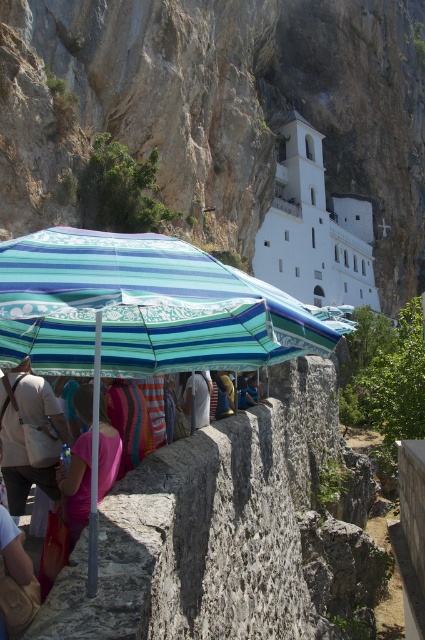
Question: Which object is positioned farthest from the pink fabric at center?

Choices:
 (A) striped fabric umbrella at center
 (B) white stone building at center

Answer: (B)

Question: Considering the relative positions of light pink fabric bag at lower left and pink fabric at center in the image provided, where is light pink fabric bag at lower left located with respect to pink fabric at center?

Choices:
 (A) right
 (B) left

Answer: (B)

Question: Among these points, which one is nearest to the camera?

Choices:
 (A) (11, 464)
 (B) (320, 248)
 (C) (104, 492)
 (D) (42, 333)

Answer: (C)

Question: Considering the real-world distances, which object is closest to the striped fabric umbrella at center?

Choices:
 (A) white cotton shirt at center
 (B) white stone building at center
 (C) pink fabric at center
 (D) light pink fabric bag at lower left

Answer: (C)

Question: Does striped fabric umbrella at center have a greater width compared to white cotton shirt at center?

Choices:
 (A) yes
 (B) no

Answer: (A)

Question: Does light pink fabric bag at lower left have a lesser width compared to pink fabric at center?

Choices:
 (A) yes
 (B) no

Answer: (B)